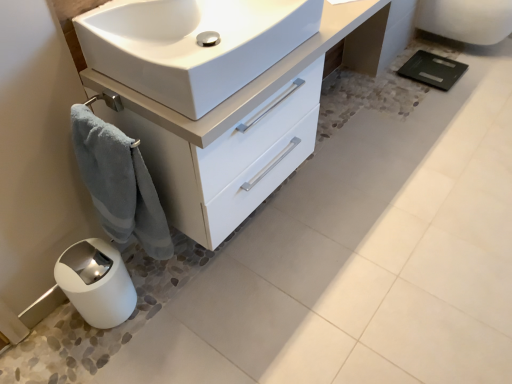
Question: Considering the relative positions of white glossy sink at center and white glossy cabinet at lower left in the image provided, is white glossy sink at center to the right of white glossy cabinet at lower left from the viewer's perspective?

Choices:
 (A) yes
 (B) no

Answer: (B)

Question: Considering the relative positions of white glossy sink at center and white glossy cabinet at lower left in the image provided, is white glossy sink at center behind white glossy cabinet at lower left?

Choices:
 (A) no
 (B) yes

Answer: (A)

Question: Considering the relative sizes of white glossy sink at center and white glossy cabinet at lower left in the image provided, is white glossy sink at center bigger than white glossy cabinet at lower left?

Choices:
 (A) yes
 (B) no

Answer: (B)

Question: Considering the relative sizes of white glossy sink at center and white glossy cabinet at lower left in the image provided, is white glossy sink at center smaller than white glossy cabinet at lower left?

Choices:
 (A) no
 (B) yes

Answer: (B)

Question: Is white glossy sink at center taller than white glossy cabinet at lower left?

Choices:
 (A) no
 (B) yes

Answer: (A)

Question: From the image's perspective, is white glossy sink at center under white glossy cabinet at lower left?

Choices:
 (A) yes
 (B) no

Answer: (A)

Question: Is the position of white glossy sink at center more distant than that of white glossy porcelain at upper right?

Choices:
 (A) yes
 (B) no

Answer: (B)

Question: Can you confirm if white glossy sink at center is positioned to the right of white glossy porcelain at upper right?

Choices:
 (A) yes
 (B) no

Answer: (B)

Question: Considering the relative sizes of white glossy sink at center and white glossy porcelain at upper right in the image provided, is white glossy sink at center shorter than white glossy porcelain at upper right?

Choices:
 (A) yes
 (B) no

Answer: (A)

Question: Is the position of white glossy sink at center less distant than that of white glossy porcelain at upper right?

Choices:
 (A) yes
 (B) no

Answer: (A)

Question: Can white glossy porcelain at upper right be found inside white glossy sink at center?

Choices:
 (A) yes
 (B) no

Answer: (B)

Question: From the image's perspective, is white glossy sink at center below white glossy porcelain at upper right?

Choices:
 (A) no
 (B) yes

Answer: (B)

Question: Is the position of blue plush towel at lower left less distant than that of white glossy cabinet at lower left?

Choices:
 (A) yes
 (B) no

Answer: (A)